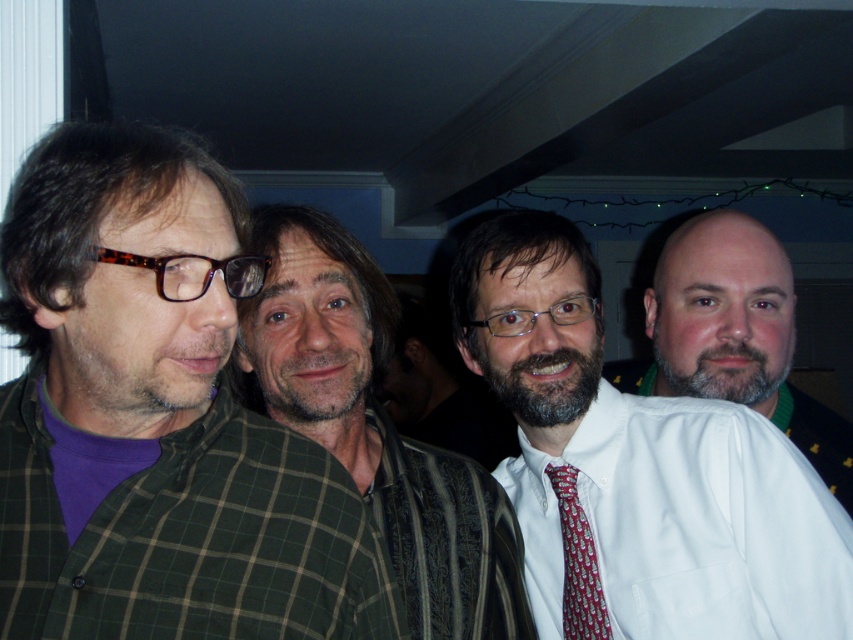
Question: Can you confirm if white shirt at right is bigger than red silk tie at center?

Choices:
 (A) no
 (B) yes

Answer: (B)

Question: Among these points, which one is nearest to the camera?

Choices:
 (A) (370, 419)
 (B) (32, 180)

Answer: (B)

Question: Can you confirm if white smooth dress shirt at center is positioned to the left of white shirt at right?

Choices:
 (A) no
 (B) yes

Answer: (B)

Question: Is green plaid shirt at left below white shirt at right?

Choices:
 (A) no
 (B) yes

Answer: (B)

Question: Which object is the farthest from the white shirt at right?

Choices:
 (A) green plaid shirt at center
 (B) white smooth dress shirt at center

Answer: (A)

Question: Which of the following is the closest to the observer?

Choices:
 (A) (74, 141)
 (B) (728, 410)
 (C) (581, 561)

Answer: (A)